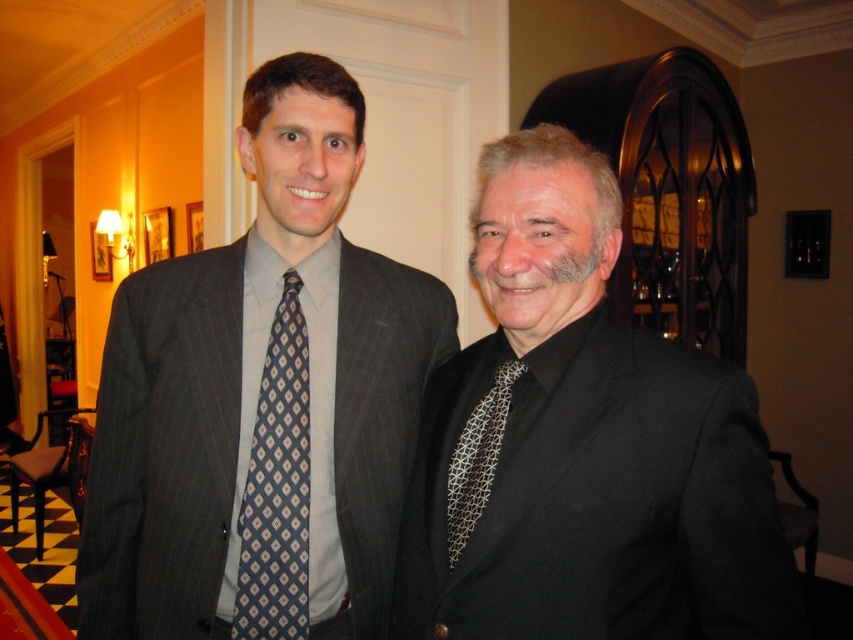
Question: Estimate the real-world distances between objects in this image. Which object is closer to the black silk suit at center?

Choices:
 (A) blue printed tie at left
 (B) matte gray suit at center
 (C) black textured tie at center

Answer: (C)

Question: Is the position of matte gray suit at center more distant than that of black textured tie at center?

Choices:
 (A) no
 (B) yes

Answer: (B)

Question: Where is black silk suit at center located in relation to blue printed tie at left in the image?

Choices:
 (A) below
 (B) above

Answer: (B)

Question: Is black silk suit at center thinner than black textured tie at center?

Choices:
 (A) yes
 (B) no

Answer: (B)

Question: Which is farther from the black textured tie at center?

Choices:
 (A) black silk suit at center
 (B) blue printed tie at left
 (C) matte gray suit at center

Answer: (C)

Question: Which of the following is the closest to the observer?

Choices:
 (A) (264, 561)
 (B) (316, 224)
 (C) (494, 429)

Answer: (C)